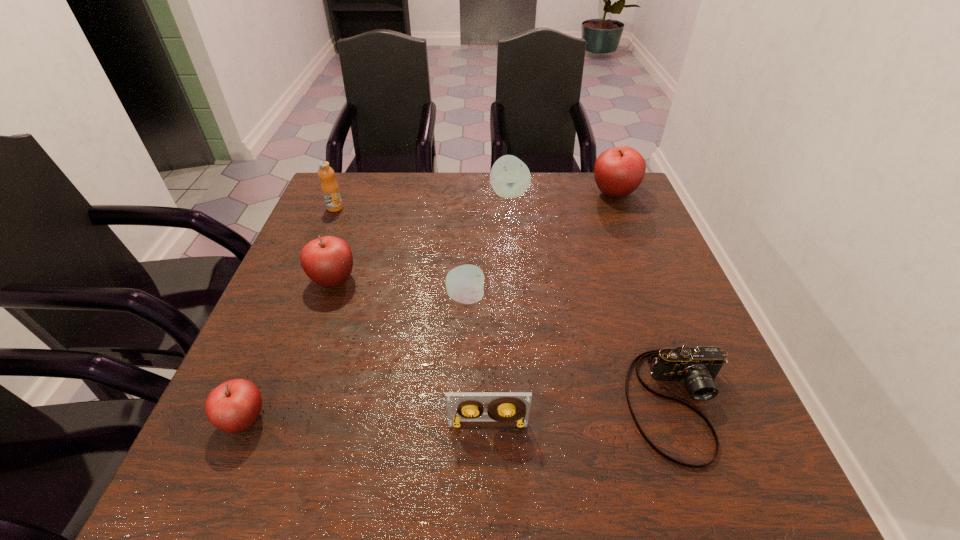
Find the location of a particular element. The image size is (960, 540). free space at the left edge of the desktop is located at coordinates (275, 318).

Locate an element on the screen. The width and height of the screenshot is (960, 540). blank space at the right edge of the desktop is located at coordinates (705, 338).

Where is `vacant space at the far left corner of the desktop`? This screenshot has height=540, width=960. vacant space at the far left corner of the desktop is located at coordinates (366, 173).

This screenshot has height=540, width=960. I want to click on free space between the second biggest red apple and the tallest apple, so [474, 237].

At what (x,y) coordinates should I click in order to perform the action: click on free space between the nearer white apple and the brown camera. Please return your answer as a coordinate pair (x, y). The width and height of the screenshot is (960, 540). Looking at the image, I should click on (573, 351).

The width and height of the screenshot is (960, 540). What are the coordinates of `blank region between the second farthest red apple and the farther white apple` in the screenshot? It's located at (421, 237).

Locate an element on the screen. The height and width of the screenshot is (540, 960). vacant space that is in between the second nearest red apple and the brown videotape is located at coordinates (411, 352).

At what (x,y) coordinates should I click in order to perform the action: click on vacant space that is in between the smallest red apple and the second smallest red apple. Please return your answer as a coordinate pair (x, y). This screenshot has width=960, height=540. Looking at the image, I should click on (289, 349).

The width and height of the screenshot is (960, 540). What are the coordinates of `free space between the farthest red apple and the smaller white apple` in the screenshot? It's located at (540, 245).

The image size is (960, 540). Identify the location of free spot between the bigger white apple and the nearer white apple. (488, 246).